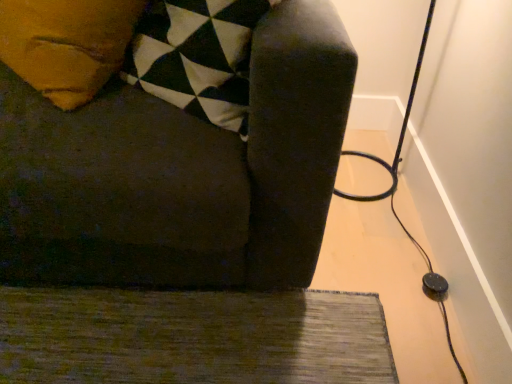
Question: Considering the relative positions of black rubber cable at right and dark fabric couch at center in the image provided, is black rubber cable at right to the right of dark fabric couch at center from the viewer's perspective?

Choices:
 (A) yes
 (B) no

Answer: (A)

Question: Considering the relative sizes of black rubber cable at right and dark fabric couch at center in the image provided, is black rubber cable at right smaller than dark fabric couch at center?

Choices:
 (A) no
 (B) yes

Answer: (B)

Question: Considering the relative sizes of black rubber cable at right and dark fabric couch at center in the image provided, is black rubber cable at right thinner than dark fabric couch at center?

Choices:
 (A) yes
 (B) no

Answer: (A)

Question: Is there a large distance between black rubber cable at right and dark fabric couch at center?

Choices:
 (A) yes
 (B) no

Answer: (B)

Question: Can you confirm if black rubber cable at right is bigger than dark fabric couch at center?

Choices:
 (A) yes
 (B) no

Answer: (B)

Question: Does black rubber cable at right have a greater height compared to dark fabric couch at center?

Choices:
 (A) yes
 (B) no

Answer: (B)

Question: Does dark fabric couch at center have a lesser width compared to black rubber cable at right?

Choices:
 (A) no
 (B) yes

Answer: (A)

Question: Is dark fabric couch at center outside of black rubber cable at right?

Choices:
 (A) no
 (B) yes

Answer: (B)

Question: From a real-world perspective, is dark fabric couch at center located higher than black rubber cable at right?

Choices:
 (A) no
 (B) yes

Answer: (B)

Question: Is dark fabric couch at center bigger than black rubber cable at right?

Choices:
 (A) yes
 (B) no

Answer: (A)

Question: Considering the relative sizes of dark fabric couch at center and black rubber cable at right in the image provided, is dark fabric couch at center shorter than black rubber cable at right?

Choices:
 (A) no
 (B) yes

Answer: (A)

Question: Is dark fabric couch at center closer to the viewer compared to black rubber cable at right?

Choices:
 (A) yes
 (B) no

Answer: (A)

Question: From the image's perspective, does black rubber cable at right appear higher than green textured rug at lower left?

Choices:
 (A) yes
 (B) no

Answer: (A)